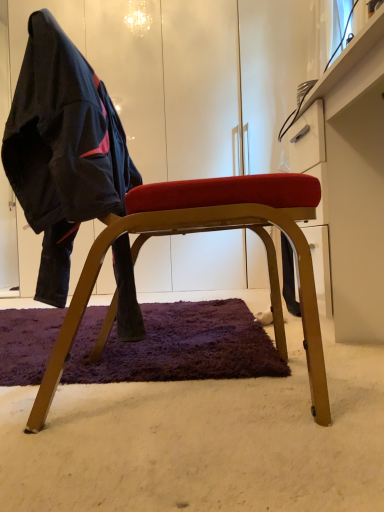
Question: Is matte black jacket at left looking in the opposite direction of wooden chair at center?

Choices:
 (A) no
 (B) yes

Answer: (B)

Question: Can you confirm if matte black jacket at left is thinner than wooden chair at center?

Choices:
 (A) yes
 (B) no

Answer: (A)

Question: From a real-world perspective, is matte black jacket at left under wooden chair at center?

Choices:
 (A) no
 (B) yes

Answer: (A)

Question: Is matte black jacket at left shorter than wooden chair at center?

Choices:
 (A) no
 (B) yes

Answer: (B)

Question: Would you say matte black jacket at left is outside wooden chair at center?

Choices:
 (A) yes
 (B) no

Answer: (B)

Question: Considering the positions of point 26,152 and point 259,226, is point 26,152 closer or farther from the camera than point 259,226?

Choices:
 (A) farther
 (B) closer

Answer: (B)

Question: Visually, is matte black jacket at left positioned to the left or to the right of wooden chair at center?

Choices:
 (A) left
 (B) right

Answer: (A)

Question: Looking at their shapes, would you say matte black jacket at left is wider or thinner than wooden chair at center?

Choices:
 (A) thin
 (B) wide

Answer: (A)

Question: From a real-world perspective, is matte black jacket at left above or below wooden chair at center?

Choices:
 (A) above
 (B) below

Answer: (A)

Question: In terms of width, does white glossy dresser at upper right look wider or thinner when compared to wooden chair at center?

Choices:
 (A) thin
 (B) wide

Answer: (A)

Question: Would you say white glossy dresser at upper right is inside or outside wooden chair at center?

Choices:
 (A) inside
 (B) outside

Answer: (B)

Question: From the image's perspective, is white glossy dresser at upper right above or below wooden chair at center?

Choices:
 (A) below
 (B) above

Answer: (B)

Question: Does point (357, 304) appear closer or farther from the camera than point (178, 212)?

Choices:
 (A) farther
 (B) closer

Answer: (A)

Question: Considering the positions of point (142, 203) and point (62, 38), is point (142, 203) closer or farther from the camera than point (62, 38)?

Choices:
 (A) closer
 (B) farther

Answer: (A)

Question: In terms of size, does wooden chair at center appear bigger or smaller than matte black jacket at left?

Choices:
 (A) small
 (B) big

Answer: (B)